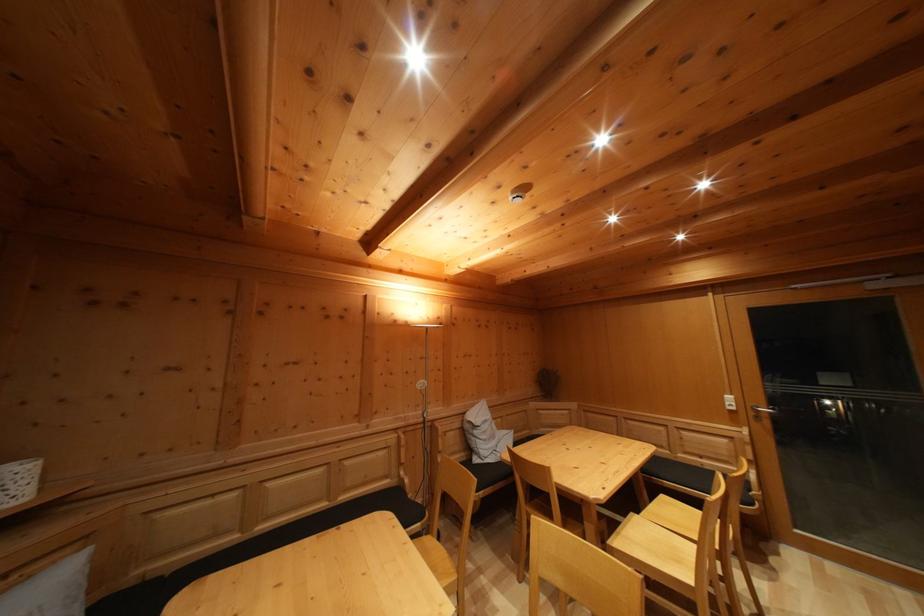
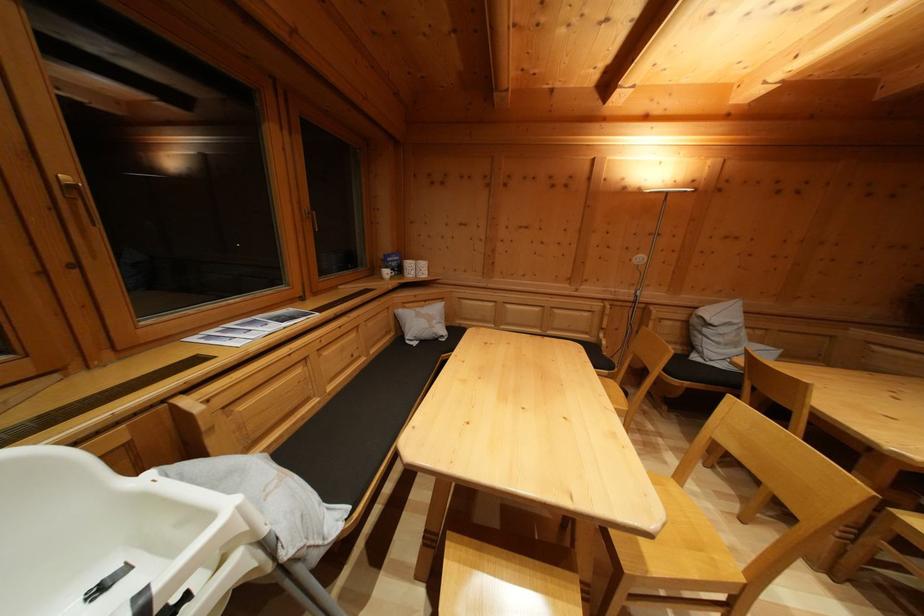
Question: I am providing you with two images of the same scene from different viewpoints. Which of the following objects are not visible in image2?

Choices:
 (A) wooden window handle
 (B) black seatbelt buckle
 (C) golden window handle
 (D) none of these

Answer: (D)